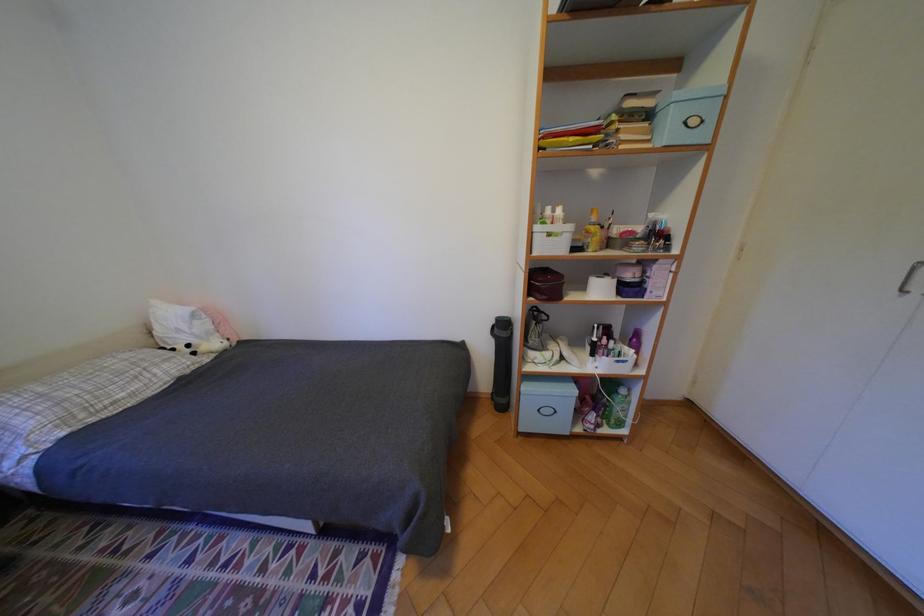
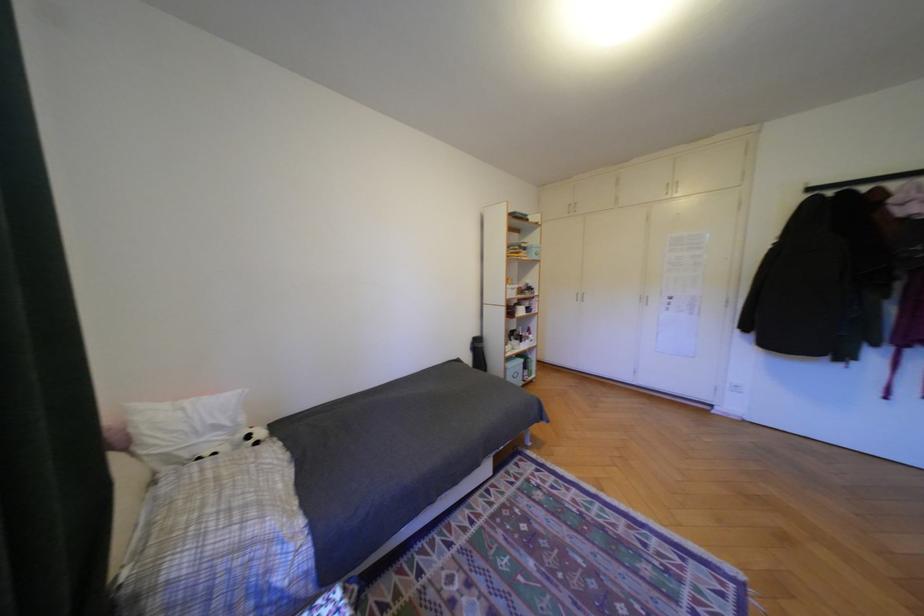
Question: I am providing you with two images of the same scene from different viewpoints. Please identify which objects are invisible in image2.

Choices:
 (A) white pillow
 (B) black trash can
 (C) closet door handle
 (D) none of these

Answer: (D)